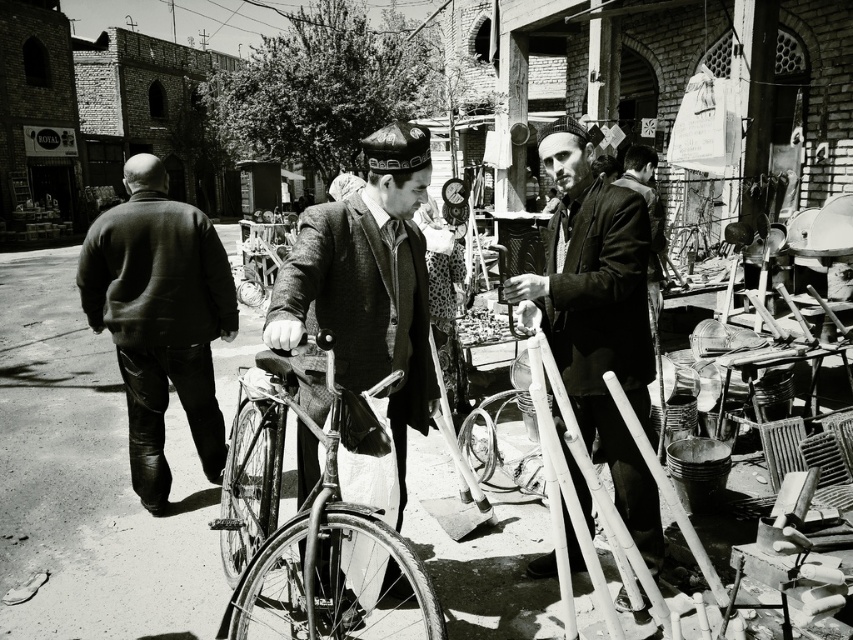
In the black and white photograph of the street scene, there is a leather jacket at left and a metallic bicycle at center. Which object is wider?

The metallic bicycle at center is wider than the leather jacket at left.